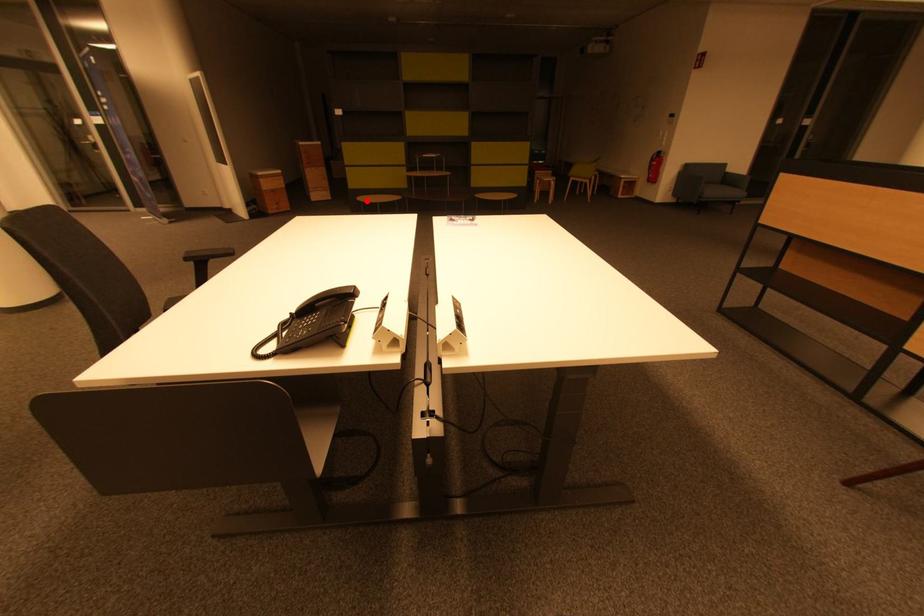
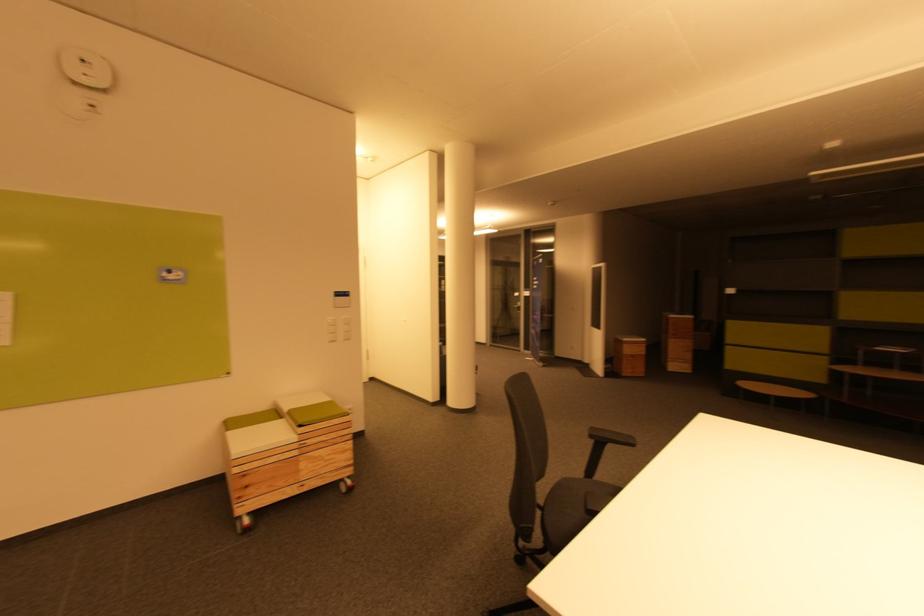
Question: I am providing you with two images of the same scene from different viewpoints. In image1, a red point is highlighted. Considering the same 3D point in image2, which of the following is correct?

Choices:
 (A) It is closer
 (B) It is farther

Answer: (B)